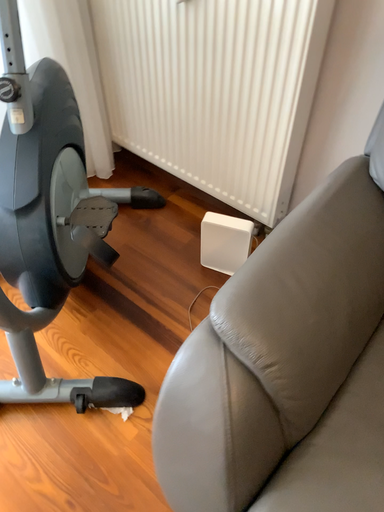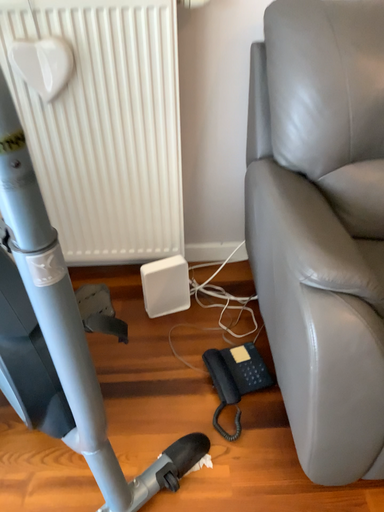
Question: How did the camera likely rotate when shooting the video?

Choices:
 (A) rotated downward
 (B) rotated upward

Answer: (B)